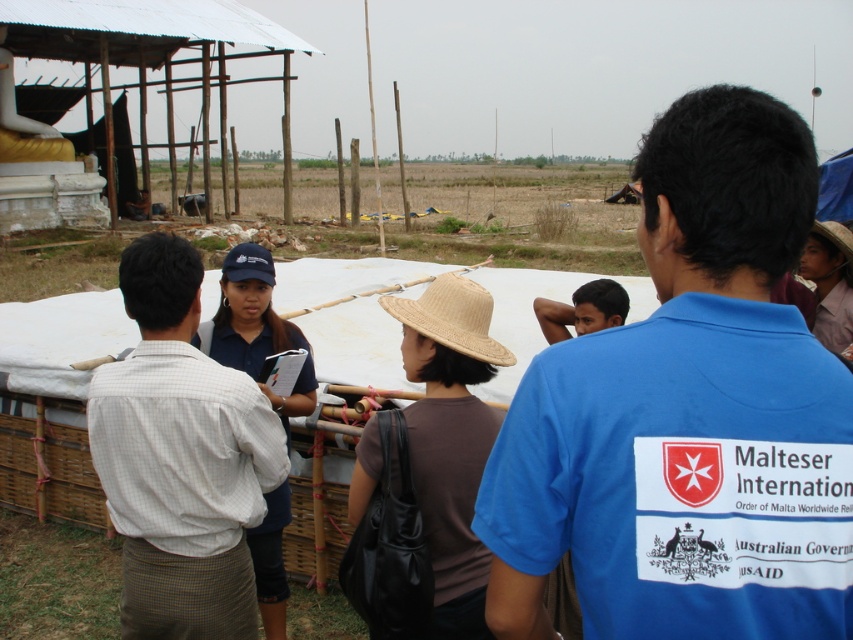
Is brown straw hat at center shorter than straw hat at center?

No, brown straw hat at center is not shorter than straw hat at center.

Between brown straw hat at center and straw hat at center, which one is positioned lower?

brown straw hat at center

Is point (563, 330) positioned before point (825, 227)?

That is False.

Locate an element on the screen. brown straw hat at center is located at coordinates (582, 310).

Between blue cotton shirt at center and tan straw hat at center, which one has more height?

blue cotton shirt at center

Which is in front, point (589, 442) or point (408, 316)?

Point (589, 442) is more forward.

This screenshot has width=853, height=640. I want to click on blue cotton shirt at center, so click(x=672, y=387).

Is tan straw hat at center shorter than natural straw hat at center?

Incorrect, tan straw hat at center's height does not fall short of natural straw hat at center's.

Is tan straw hat at center closer to camera compared to natural straw hat at center?

Yes, tan straw hat at center is in front of natural straw hat at center.

Does point (396, 310) come in front of point (224, 276)?

That is True.

Locate an element on the screen. The width and height of the screenshot is (853, 640). tan straw hat at center is located at coordinates (451, 317).